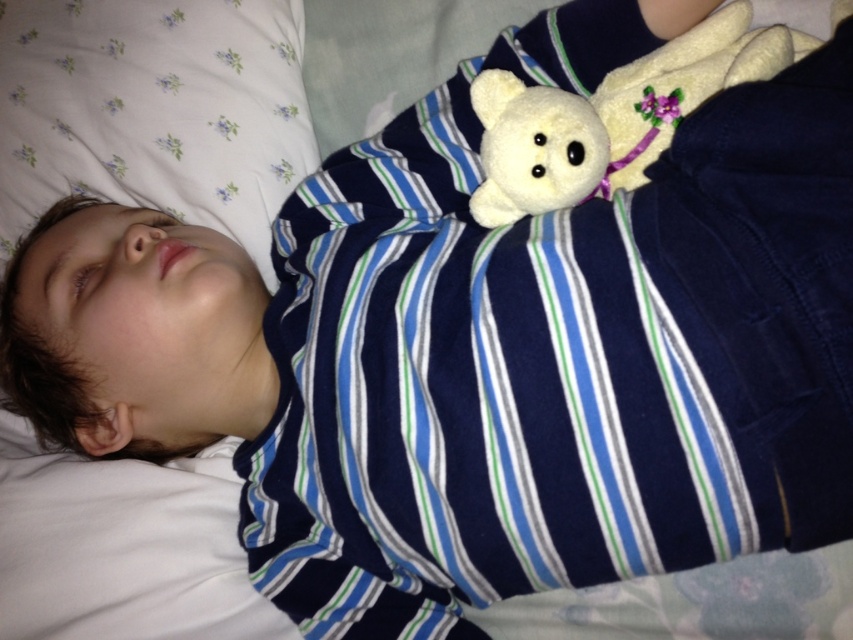
You are a sleep consultant trying to ensure the child has a safe sleeping environment. The recommended safe sleep guidelines suggest that soft objects like pillows and stuffed animals should be removed from the sleep area. However, you notice the white soft pillow at upper left and the white plush bear at upper right in the child bed. Based on their sizes, which object is more likely to pose a suffocation risk if left in the bed?

The white soft pillow at upper left is more likely to pose a suffocation risk because it might be wider than the white plush bear at upper right, making it larger and potentially blocking the child airway more easily.

You are a parent checking on your child. You see the white soft pillow at upper left and the white plush bear at upper right. Which object is closer to the bottom edge of the bed?

The white soft pillow at upper left is located below the white plush bear at upper right, so it is closer to the bottom edge of the bed.

You are a parent checking on your child. You see the white soft pillow at upper left and the white plush bear at upper right. How far apart are these two items from each other?

The white soft pillow at upper left and white plush bear at upper right are 17.00 inches apart.